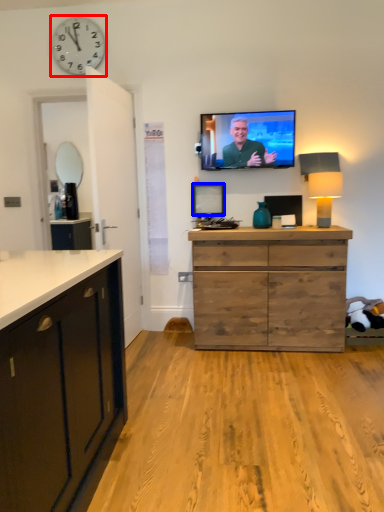
Question: Which of the following is the closest to the observer, clock (highlighted by a red box) or picture frame (highlighted by a blue box)?

Choices:
 (A) clock
 (B) picture frame

Answer: (A)